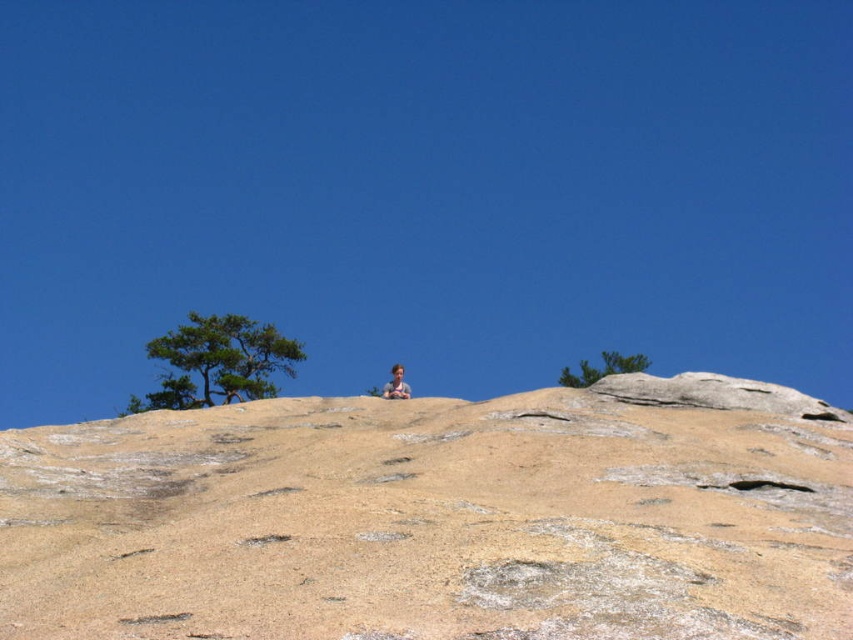
Question: Does green leafy tree at upper center come behind smooth tan skin at center?

Choices:
 (A) yes
 (B) no

Answer: (A)

Question: Which of the following is the farthest from the observer?

Choices:
 (A) (399, 378)
 (B) (91, 451)
 (C) (625, 372)

Answer: (C)

Question: Which point is closer to the camera?

Choices:
 (A) green leafy tree at upper center
 (B) beige rock at center
 (C) green leafy tree at upper left
 (D) smooth tan skin at center

Answer: (B)

Question: Does beige rock at center have a larger size compared to green leafy tree at upper center?

Choices:
 (A) yes
 (B) no

Answer: (B)

Question: Can you confirm if beige rock at center is wider than smooth tan skin at center?

Choices:
 (A) no
 (B) yes

Answer: (B)

Question: Which point appears closest to the camera in this image?

Choices:
 (A) (379, 436)
 (B) (605, 365)

Answer: (A)